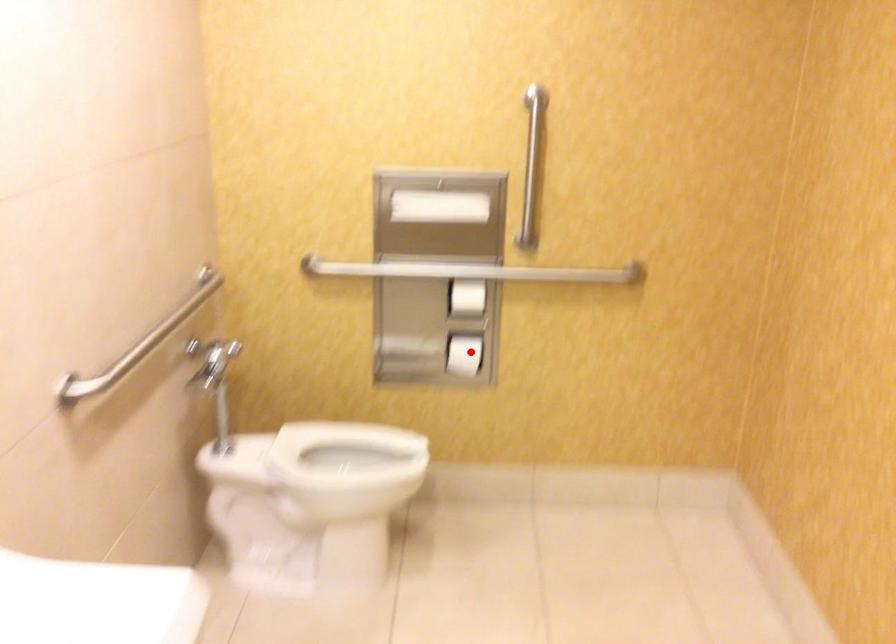
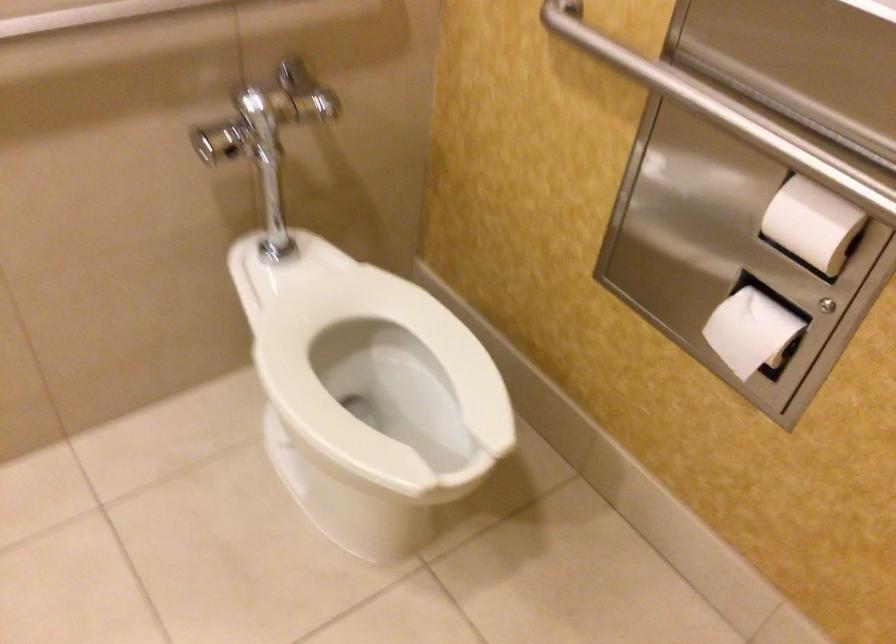
Where in the second image is the point corresponding to the highlighted location from the first image?

(751, 330)